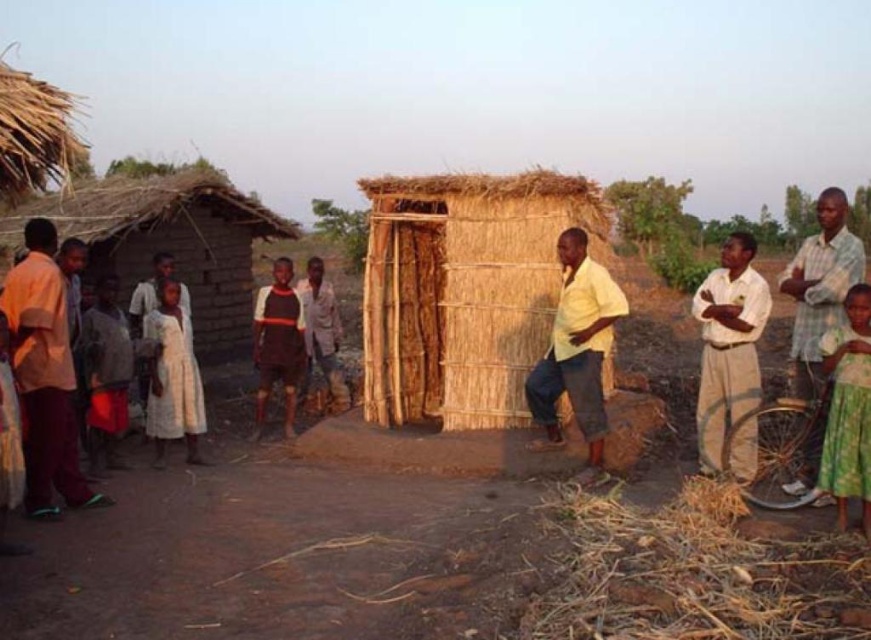
Is thatched mud hut at left positioned before white cotton dress at center?

No, thatched mud hut at left is behind white cotton dress at center.

Between point (206, 321) and point (179, 291), which one is positioned behind?

The point (206, 321) is behind.

Is point (122, 253) closer to camera compared to point (169, 304)?

No, it is not.

The width and height of the screenshot is (871, 640). I want to click on thatched mud hut at left, so click(169, 243).

Can you confirm if checkered fabric shirt at right is positioned to the left of green textured dress at lower right?

No, checkered fabric shirt at right is not to the left of green textured dress at lower right.

Does point (841, 289) come behind point (844, 304)?

That is True.

The height and width of the screenshot is (640, 871). I want to click on checkered fabric shirt at right, so [x=820, y=289].

Can you confirm if white cotton shirt at right is wider than green textured dress at lower right?

Yes.

Does white cotton shirt at right have a greater height compared to green textured dress at lower right?

Indeed, white cotton shirt at right has a greater height compared to green textured dress at lower right.

Is point (755, 452) more distant than point (848, 476)?

That is True.

Find the location of a particular element. Image resolution: width=871 pixels, height=640 pixels. white cotton shirt at right is located at coordinates (728, 346).